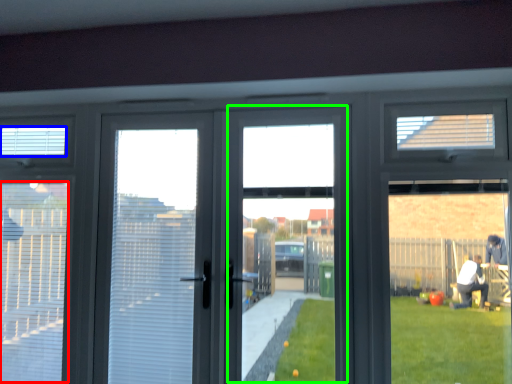
Question: Which object is positioned closest to blind (highlighted by a red box)? Select from blind (highlighted by a blue box) and window screen (highlighted by a green box).

Choices:
 (A) blind
 (B) window screen

Answer: (A)